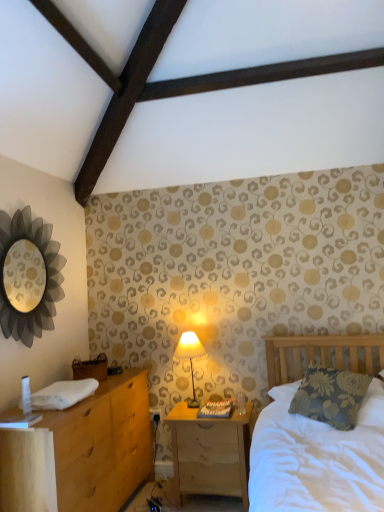
The height and width of the screenshot is (512, 384). I want to click on empty space that is ontop of wooden nightstand at lower center, so click(x=212, y=408).